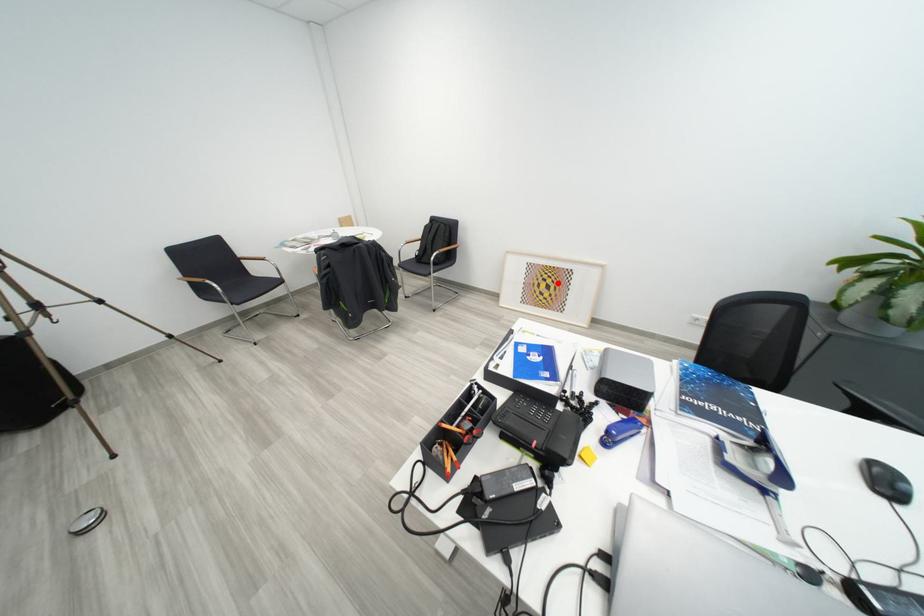
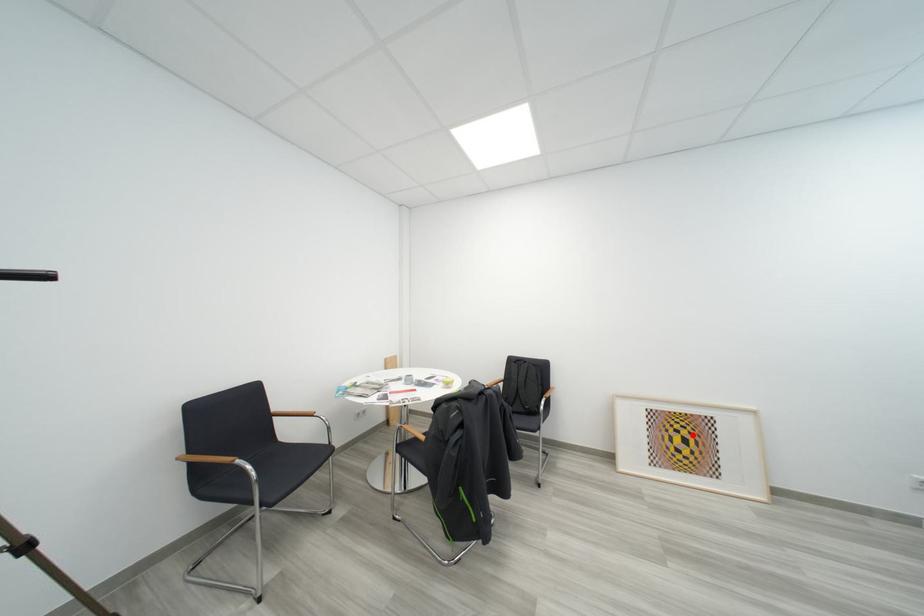
I am providing you with two images of the same scene from different viewpoints. A red point is marked on the first image and another point is marked on the second image. Are the points marked in image1 and image2 representing the same 3D position?

Yes